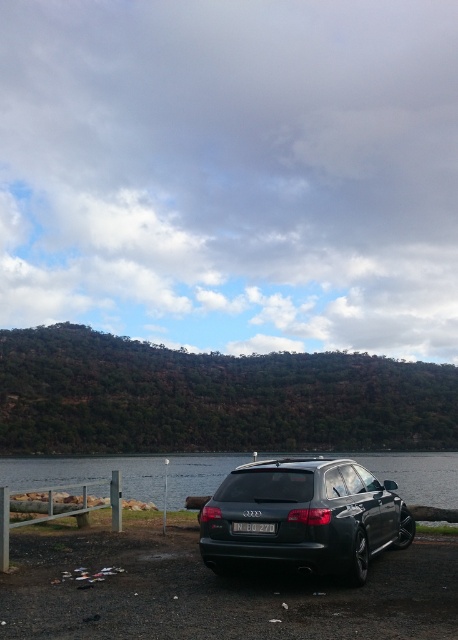
Question: Which object is closer to the camera taking this photo?

Choices:
 (A) dark metallic car at center
 (B) white plastic license plate at center

Answer: (A)

Question: Is dark metallic car at center closer to camera compared to clear water at lower center?

Choices:
 (A) no
 (B) yes

Answer: (B)

Question: Among these objects, which one is nearest to the camera?

Choices:
 (A) clear water at lower center
 (B) white plastic license plate at center

Answer: (B)

Question: Is dark metallic car at center to the right of clear water at lower center from the viewer's perspective?

Choices:
 (A) no
 (B) yes

Answer: (B)

Question: Is dark metallic car at center thinner than clear water at lower center?

Choices:
 (A) no
 (B) yes

Answer: (B)

Question: Which of the following is the farthest from the observer?

Choices:
 (A) white plastic license plate at center
 (B) dark metallic car at center
 (C) clear water at lower center

Answer: (C)